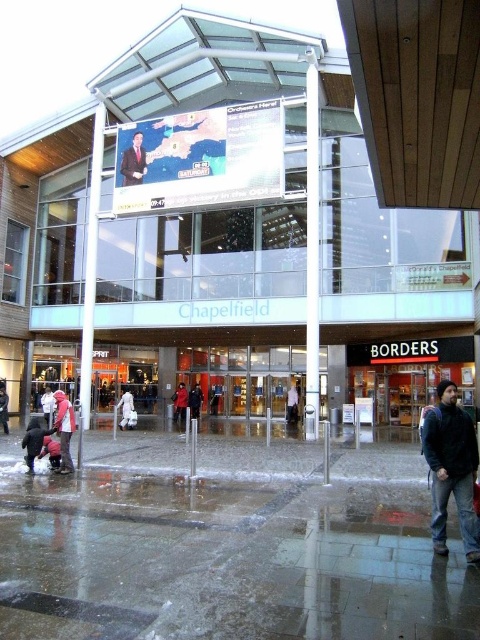
Between dark blue jacket at center and light blue shirt at center, which one has less height?

dark blue jacket at center is shorter.

Locate an element on the screen. dark blue jacket at center is located at coordinates (194, 401).

Is dark blue jeans at lower right bigger than shiny suit at center?

Actually, dark blue jeans at lower right might be smaller than shiny suit at center.

Does dark blue jeans at lower right have a greater width compared to shiny suit at center?

No.

This screenshot has width=480, height=640. What do you see at coordinates (451, 468) in the screenshot?
I see `dark blue jeans at lower right` at bounding box center [451, 468].

You are a GUI agent. You are given a task and a screenshot of the screen. Output one action in this format:
    pyautogui.click(x=<x>, y=<y>)
    Task: Click on the dark blue jeans at lower right
    The image size is (480, 640).
    Given the screenshot: What is the action you would take?
    451,468

Who is taller, glass storefront at center or shiny suit at center?

With more height is glass storefront at center.

Does point (253, 124) come farther from viewer compared to point (144, 150)?

No, it is not.

Locate an element on the screen. glass storefront at center is located at coordinates (250, 204).